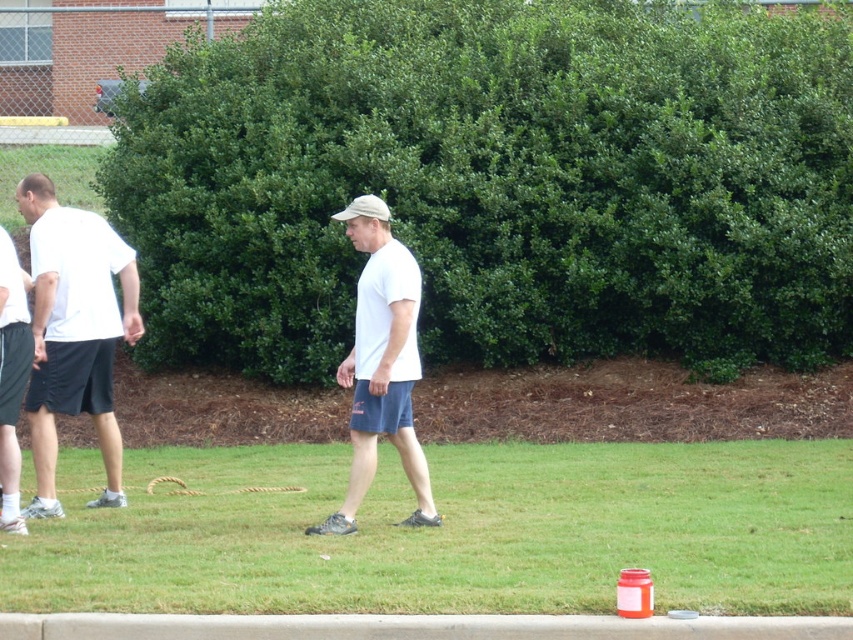
Question: Which point appears farthest from the camera in this image?

Choices:
 (A) (82, 289)
 (B) (366, 428)

Answer: (A)

Question: Which object is the closest to the white matte shirt at center?

Choices:
 (A) white matte shorts at left
 (B) green leafy bush at center
 (C) matte black shorts at left

Answer: (C)

Question: Does white matte shirt at center appear on the right side of matte black shorts at left?

Choices:
 (A) yes
 (B) no

Answer: (A)

Question: In this image, where is green grass at lower center located relative to white matte shirt at center?

Choices:
 (A) below
 (B) above

Answer: (A)

Question: Based on their relative distances, which object is nearer to the matte black shorts at left?

Choices:
 (A) white matte shirt at center
 (B) white matte shorts at left

Answer: (B)

Question: Observing the image, what is the correct spatial positioning of green grass at lower center in reference to white matte baseball hat at center?

Choices:
 (A) left
 (B) right

Answer: (A)